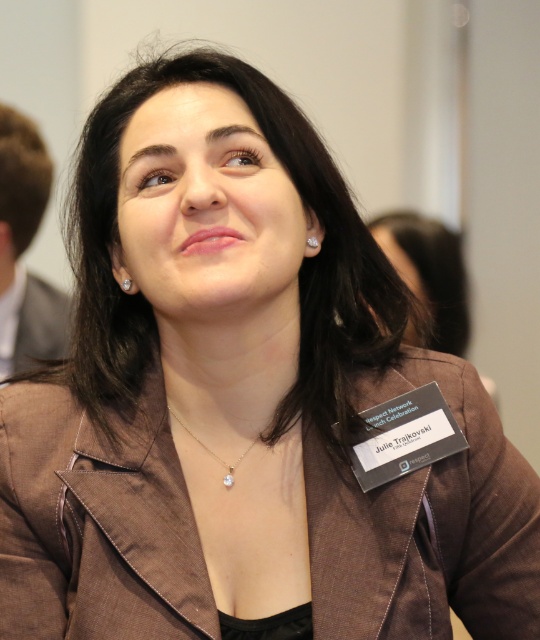
You are standing at the point closest to the woman in the image. Which coordinate point, point A at (16, 276) or point B at (233, 468), is farther away from you?

Point A at (16, 276) is behind point B at (233, 468), so it is farther away from you.

In the scene shown: You are a photographer standing in front of the white cotton shirt at left. You want to take a photo of it but need to be at least 1.5 meters away to avoid blurring. Can you safely take the photo from your current position?

The white cotton shirt at left and viewer are 1.69 meters apart, so yes, you can safely take the photo from your current position since the distance is more than the required 1.5 meters.